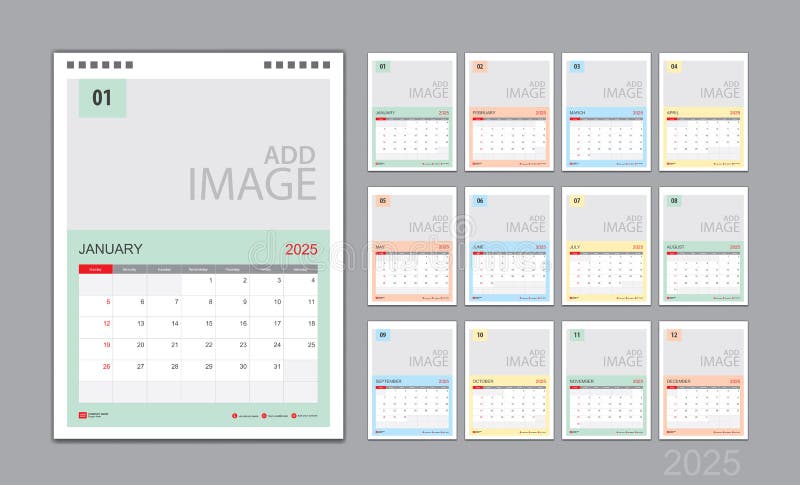
The width and height of the screenshot is (800, 485). Find the location of `green colored border calanders`. green colored border calanders is located at coordinates (404, 145), (216, 335), (608, 397), (714, 260).